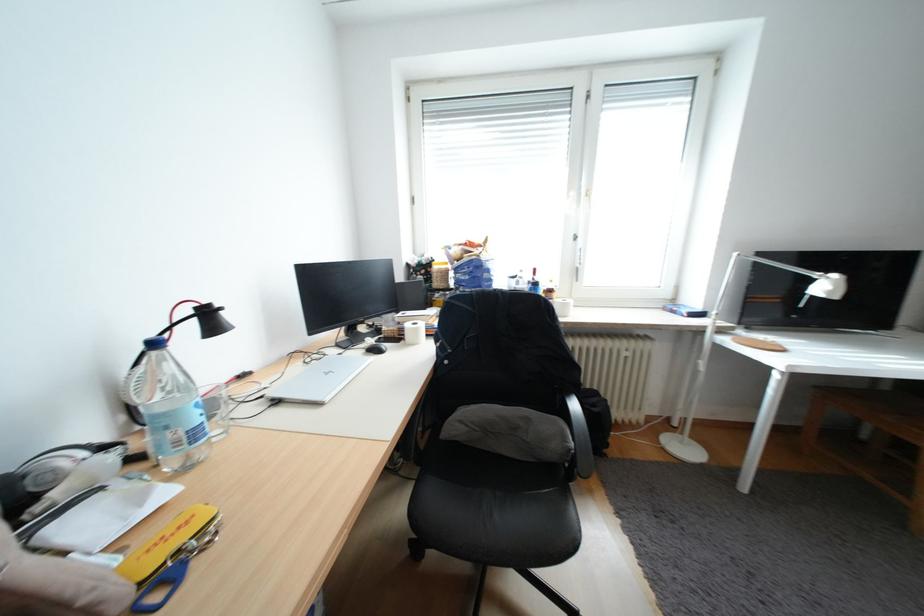
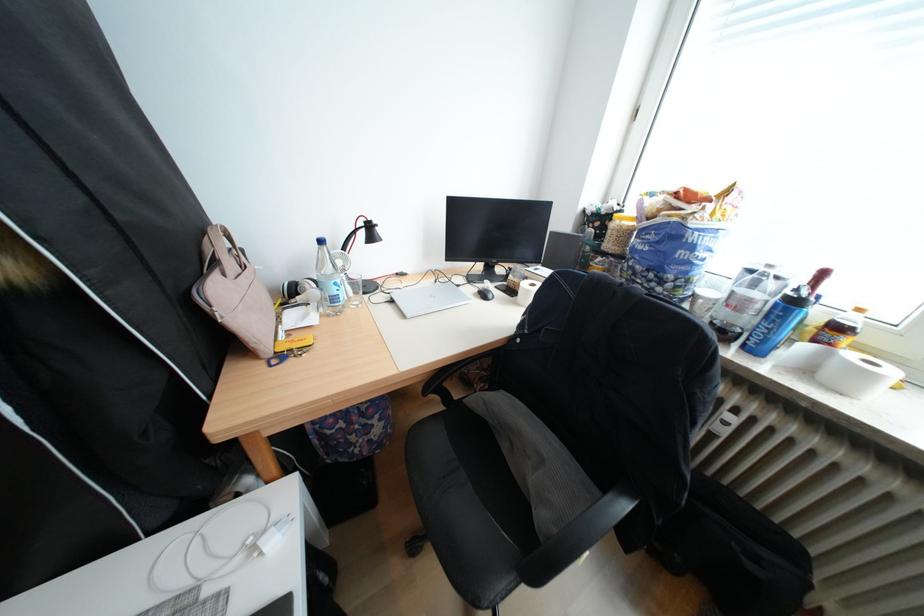
In the second image, find the point that corresponds to (x=289, y=403) in the first image.

(405, 302)